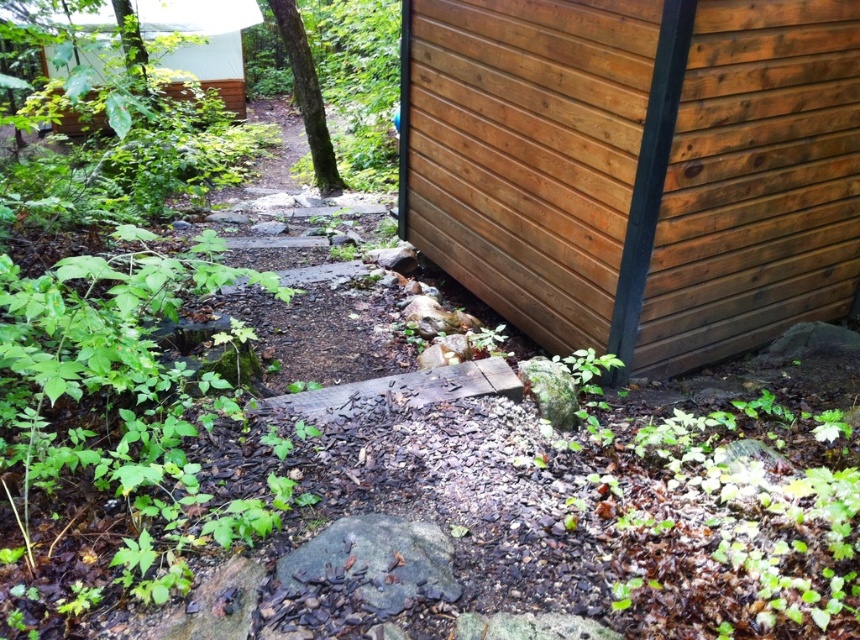
Question: Can you confirm if wooden hut at right is positioned below white wood hut at upper left?

Choices:
 (A) yes
 (B) no

Answer: (A)

Question: Considering the real-world distances, which object is farthest from the white wood hut at upper left?

Choices:
 (A) green rough bark tree at upper left
 (B) wooden hut at right

Answer: (B)

Question: Which point is closer to the camera taking this photo?

Choices:
 (A) (231, 88)
 (B) (336, 193)

Answer: (B)

Question: Can you confirm if wooden hut at right is smaller than white wood hut at upper left?

Choices:
 (A) yes
 (B) no

Answer: (B)

Question: Does wooden hut at right have a larger size compared to white wood hut at upper left?

Choices:
 (A) no
 (B) yes

Answer: (B)

Question: Which of the following is the farthest from the observer?

Choices:
 (A) (222, 76)
 (B) (725, 54)

Answer: (A)